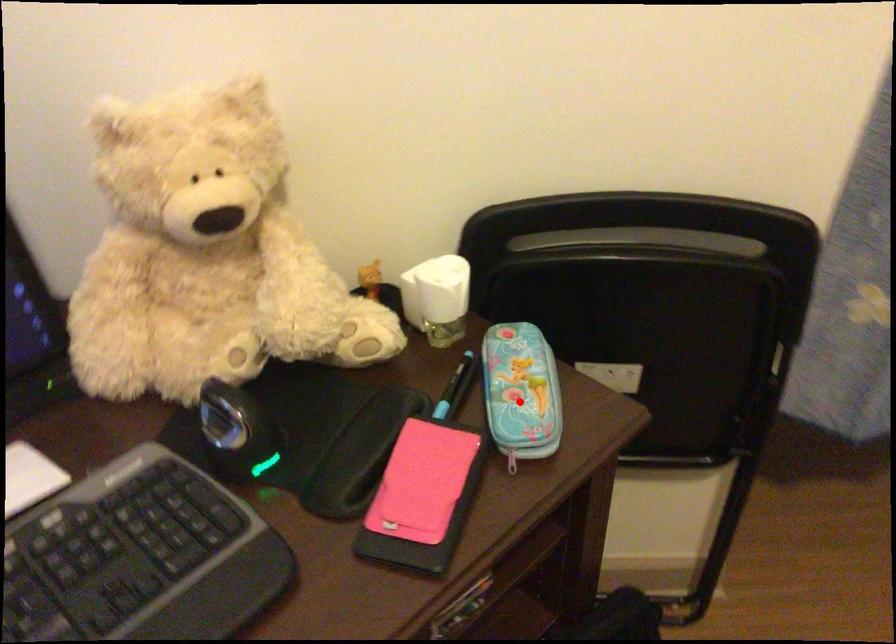
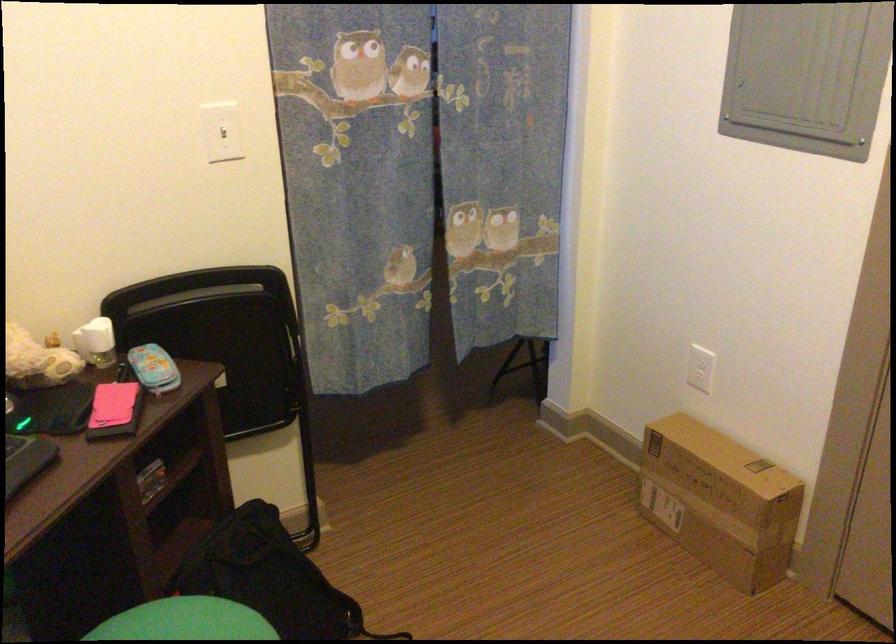
The point at the highlighted location is marked in the first image. Where is the corresponding point in the second image?

(153, 368)